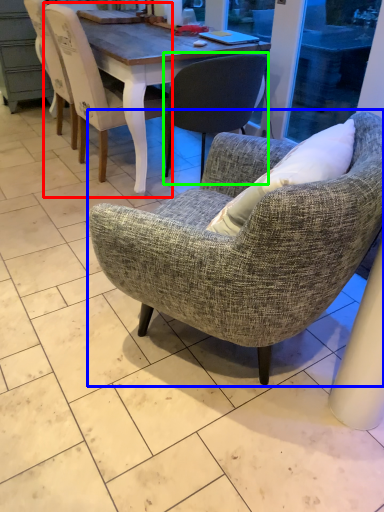
Question: Which object is the farthest from chair (highlighted by a red box)? Choose among these: chair (highlighted by a blue box) or chair (highlighted by a green box).

Choices:
 (A) chair
 (B) chair

Answer: (A)